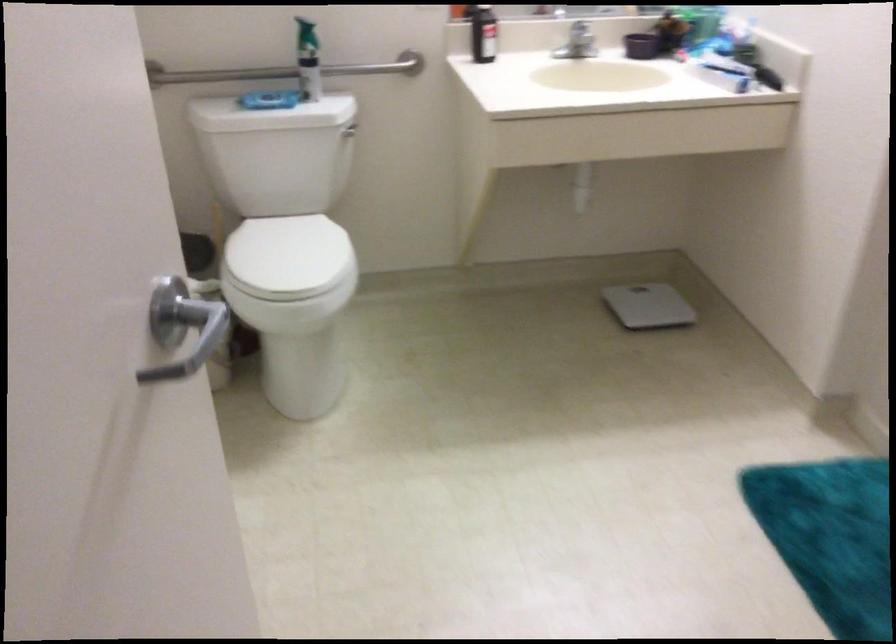
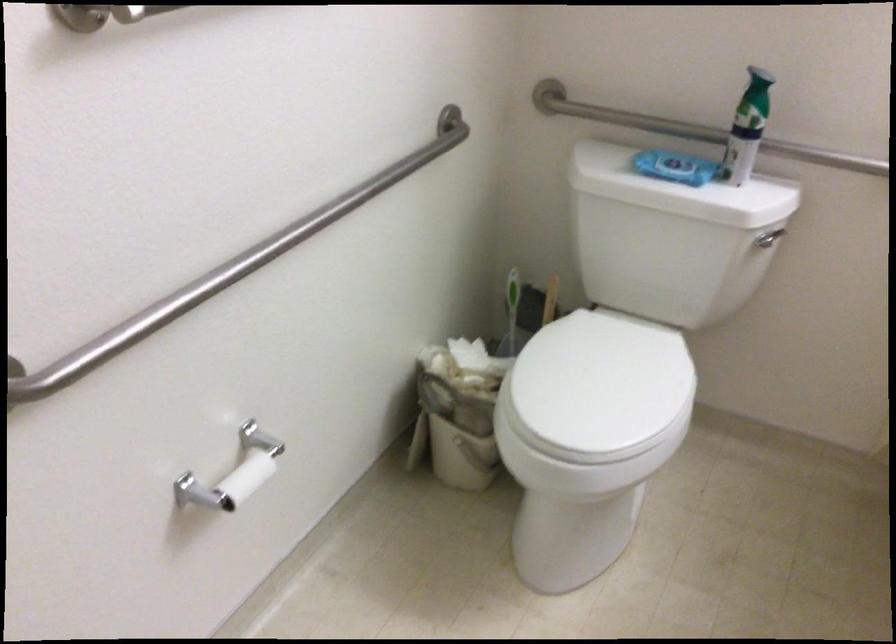
Question: Based on the continuous images, in which direction is the camera rotating? Reply with the corresponding letter.

Choices:
 (A) Left
 (B) Right
 (C) Up
 (D) Down

Answer: (A)